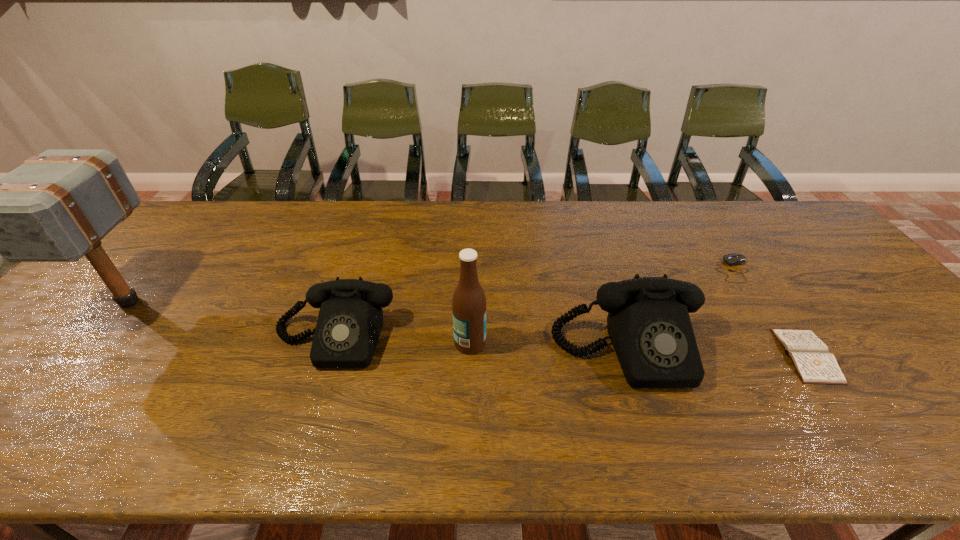
Where is `free space located on the dial of the left telephone`? Image resolution: width=960 pixels, height=540 pixels. free space located on the dial of the left telephone is located at coordinates click(x=316, y=393).

Locate an element on the screen. blank space located on the striking surface of the mallet is located at coordinates (83, 356).

Find the location of a particular element. This screenshot has width=960, height=540. free region located on the right of the second shortest object is located at coordinates (836, 270).

Locate an element on the screen. free space located on the back of the diary is located at coordinates (732, 250).

This screenshot has width=960, height=540. Identify the location of vacant space situated 0.330m on the back of the beer bottle. (472, 251).

Find the location of a particular element. The image size is (960, 540). telephone located in the near edge section of the desktop is located at coordinates (648, 322).

Where is `diary located at the near edge`? diary located at the near edge is located at coordinates (811, 358).

In order to click on object present at the left edge in this screenshot , I will do `click(56, 207)`.

The image size is (960, 540). In order to click on free spot at the far edge of the desktop in this screenshot , I will do `click(691, 235)`.

This screenshot has height=540, width=960. In the image, there is a desktop. Identify the location of vacant space at the left edge. (88, 288).